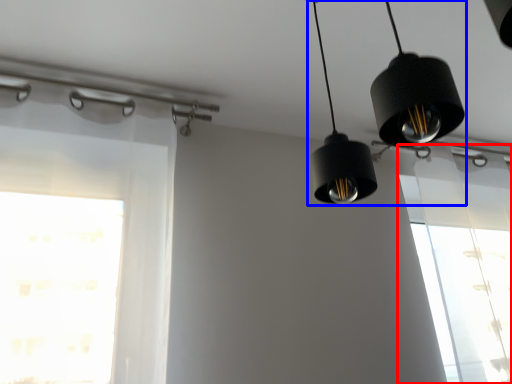
Question: Which of the following is the closest to the observer, window (highlighted by a red box) or lighting (highlighted by a blue box)?

Choices:
 (A) window
 (B) lighting

Answer: (B)